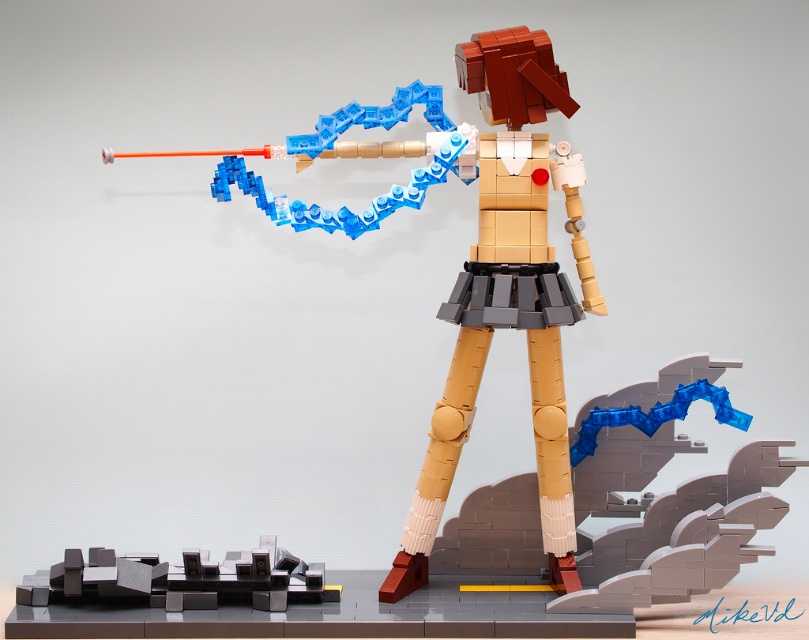
Between matte brown figure at center and dark gray plastic cityscape at lower left, which one is positioned lower?

Positioned lower is dark gray plastic cityscape at lower left.

Is matte brown figure at center positioned before dark gray plastic cityscape at lower left?

Yes, matte brown figure at center is closer to the viewer.

This screenshot has height=640, width=809. Describe the element at coordinates (471, 262) in the screenshot. I see `matte brown figure at center` at that location.

This screenshot has width=809, height=640. What are the coordinates of `matte brown figure at center` in the screenshot? It's located at (471, 262).